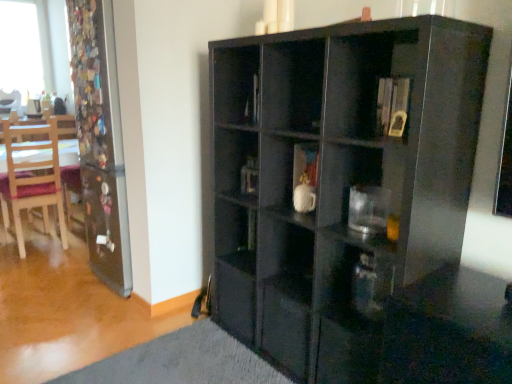
Question: Is wooden chair at left, the 1th chair viewed from the left, to the left of glossy black cabinet at center from the viewer's perspective?

Choices:
 (A) yes
 (B) no

Answer: (A)

Question: Considering the relative sizes of wooden chair at left, the 1th chair viewed from the left, and glossy black cabinet at center in the image provided, is wooden chair at left, the 1th chair viewed from the left, wider than glossy black cabinet at center?

Choices:
 (A) yes
 (B) no

Answer: (B)

Question: Is wooden chair at left, the second chair from the right, not close to glossy black cabinet at center?

Choices:
 (A) no
 (B) yes

Answer: (B)

Question: Is wooden chair at left, which ranks as the 1th chair in top-to-bottom order, bigger than glossy black cabinet at center?

Choices:
 (A) yes
 (B) no

Answer: (B)

Question: Is wooden chair at left, the 2th chair in the bottom-to-top sequence, to the right of glossy black cabinet at center from the viewer's perspective?

Choices:
 (A) yes
 (B) no

Answer: (B)

Question: Are wooden chair at left, the 1th chair positioned from the back, and glossy black cabinet at center beside each other?

Choices:
 (A) no
 (B) yes

Answer: (A)

Question: Considering the relative sizes of transparent glass screen door at left and transparent glass window at upper left in the image provided, is transparent glass screen door at left thinner than transparent glass window at upper left?

Choices:
 (A) no
 (B) yes

Answer: (A)

Question: Does transparent glass screen door at left appear on the left side of transparent glass window at upper left?

Choices:
 (A) yes
 (B) no

Answer: (B)

Question: From a real-world perspective, is transparent glass screen door at left positioned over transparent glass window at upper left based on gravity?

Choices:
 (A) no
 (B) yes

Answer: (A)

Question: From a real-world perspective, is transparent glass screen door at left positioned under transparent glass window at upper left based on gravity?

Choices:
 (A) no
 (B) yes

Answer: (B)

Question: Considering the relative sizes of transparent glass screen door at left and transparent glass window at upper left in the image provided, is transparent glass screen door at left shorter than transparent glass window at upper left?

Choices:
 (A) no
 (B) yes

Answer: (A)

Question: Is transparent glass screen door at left further to camera compared to transparent glass window at upper left?

Choices:
 (A) yes
 (B) no

Answer: (B)

Question: Can you confirm if wooden chair at left, marked as the first chair in a front-to-back arrangement, is taller than transparent glass screen door at left?

Choices:
 (A) no
 (B) yes

Answer: (A)